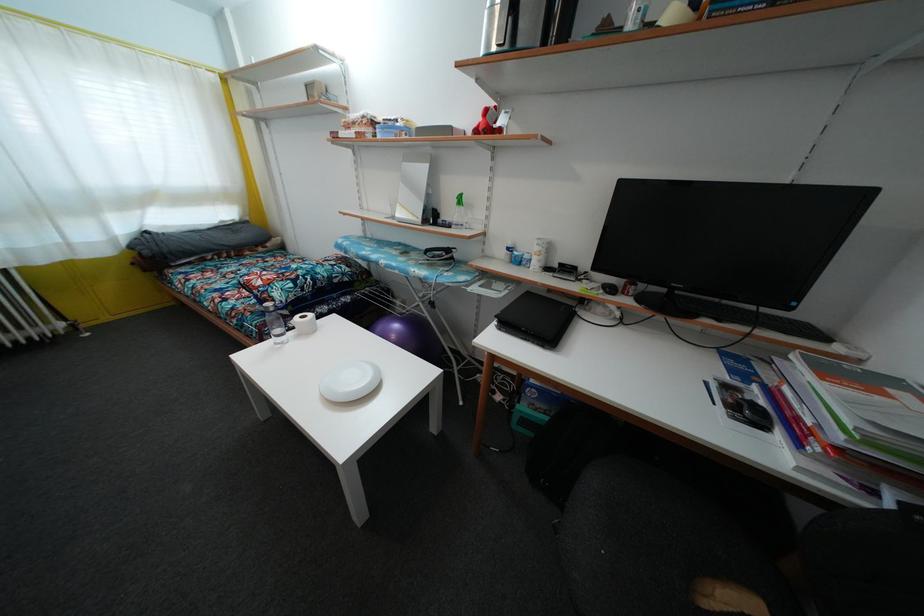
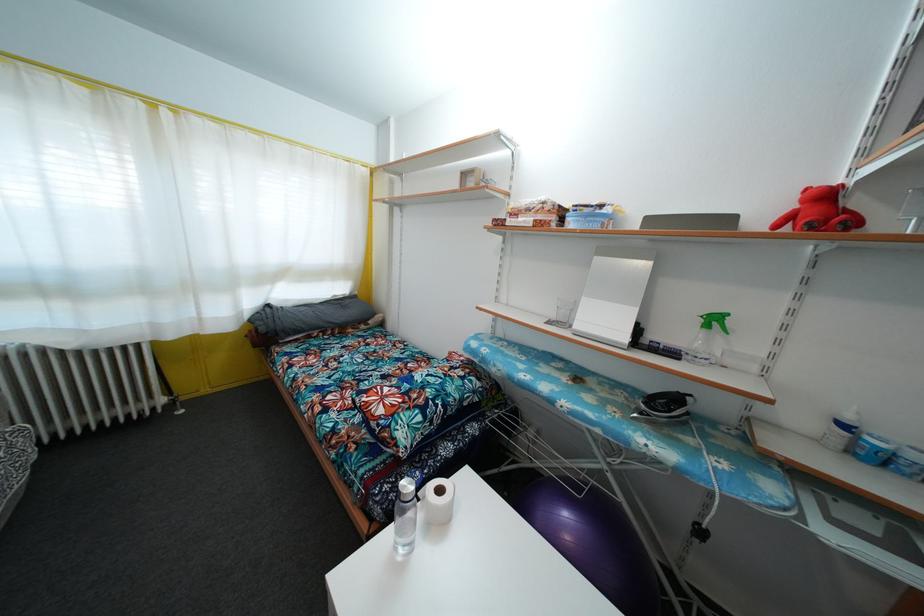
Where in the second image is the point corresponding to the point at 307,323 from the first image?

(444, 498)